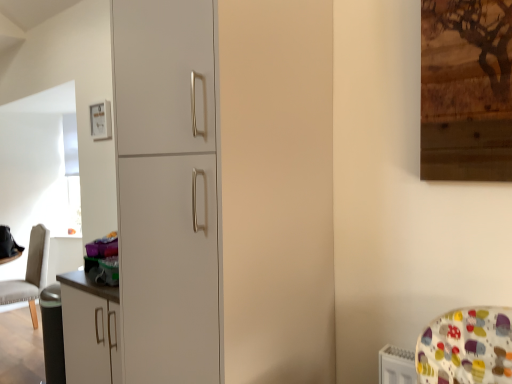
Question: Considering the positions of point (323, 105) and point (94, 127), is point (323, 105) closer or farther from the camera than point (94, 127)?

Choices:
 (A) closer
 (B) farther

Answer: (A)

Question: Is white matte cabinet at center situated inside matte white picture frame at upper left or outside?

Choices:
 (A) inside
 (B) outside

Answer: (B)

Question: Estimate the real-world distances between objects in this image. Which object is closer to the leather-like beige chair at left?

Choices:
 (A) matte white picture frame at upper left
 (B) white matte cabinet at center

Answer: (A)

Question: Estimate the real-world distances between objects in this image. Which object is farther from the white matte cabinet at center?

Choices:
 (A) matte white picture frame at upper left
 (B) leather-like beige chair at left

Answer: (B)